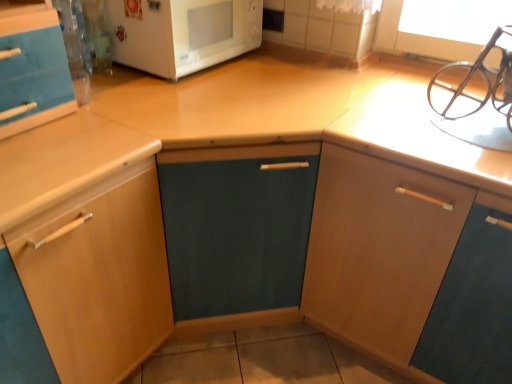
Where is `vacant area that is in front of metallic silver sink at upper right`? The height and width of the screenshot is (384, 512). vacant area that is in front of metallic silver sink at upper right is located at coordinates (466, 151).